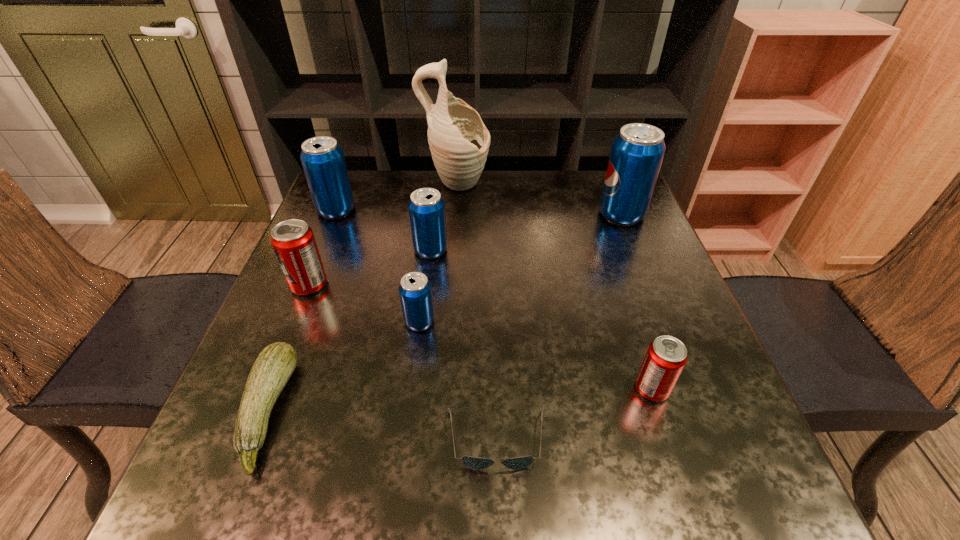
Image resolution: width=960 pixels, height=540 pixels. In order to click on empty space that is in between the smaller red soda can and the green zucchini in this screenshot , I will do `click(460, 400)`.

Find the location of a particular element. The width and height of the screenshot is (960, 540). unoccupied area between the smaller red soda can and the smallest blue pop soda is located at coordinates (536, 355).

Locate an element on the screen. vacant space that is in between the nearer red soda can and the tallest object is located at coordinates pos(554,287).

Where is `free space between the third tallest object and the left red soda can`? The image size is (960, 540). free space between the third tallest object and the left red soda can is located at coordinates (323, 247).

Identify the location of free spot between the eighth tallest object and the sunglasses. This screenshot has height=540, width=960. (382, 425).

Locate an element on the screen. This screenshot has height=540, width=960. vacant point located between the second smallest blue pop soda and the leftmost blue pop soda is located at coordinates (383, 230).

You are a GUI agent. You are given a task and a screenshot of the screen. Output one action in this format:
    pyautogui.click(x=<x>, y=<y>)
    Task: Click on the vacant area that lies between the tallest object and the sunglasses
    
    Given the screenshot: What is the action you would take?
    pyautogui.click(x=476, y=313)

Identify the location of vacant point located between the shortest object and the nearest soda can. (574, 414).

Identify the location of free area in between the smaller red soda can and the farther red soda can. pos(480,337).

Identify which object is the sixth nearest to the fourth nearest soda can. Please provide its 2D coordinates. Your answer should be formatted as a tuple, i.e. [(x, y)], where the tuple contains the x and y coordinates of a point satisfying the conditions above.

[(476, 463)]